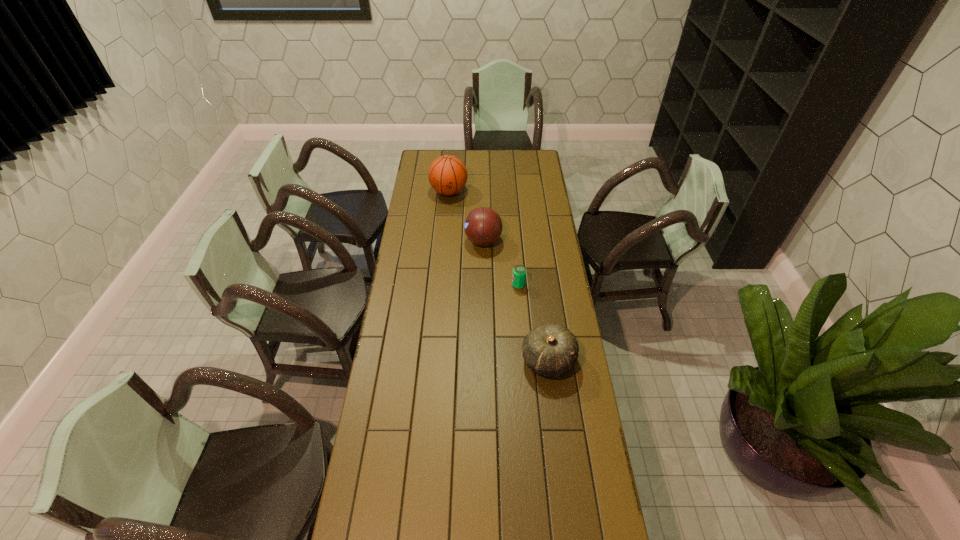
You are a GUI agent. You are given a task and a screenshot of the screen. Output one action in this format:
    pyautogui.click(x=<x>, y=<y>)
    Task: Click on the free space between the gourd and the nearer basketball
    
    Given the screenshot: What is the action you would take?
    pyautogui.click(x=516, y=301)

This screenshot has width=960, height=540. In order to click on free space between the second farthest object and the nearest object in this screenshot , I will do [516, 301].

You are a GUI agent. You are given a task and a screenshot of the screen. Output one action in this format:
    pyautogui.click(x=<x>, y=<y>)
    Task: Click on the free space between the pop soda and the third tallest object
    This screenshot has height=540, width=960.
    Given the screenshot: What is the action you would take?
    pyautogui.click(x=533, y=323)

Where is `empty space between the farther basketball and the shorter basketball`? The height and width of the screenshot is (540, 960). empty space between the farther basketball and the shorter basketball is located at coordinates (466, 217).

Select which object is the closest to the nearer basketball. Please provide its 2D coordinates. Your answer should be formatted as a tuple, i.e. [(x, y)], where the tuple contains the x and y coordinates of a point satisfying the conditions above.

[(519, 272)]

Identify the location of object that can be found as the closest to the shorter basketball. This screenshot has width=960, height=540. 519,272.

Identify the location of vacant point that satisfies the following two spatial constraints: 1. on the front side of the nearer basketball; 2. on the left side of the farthest object. The width and height of the screenshot is (960, 540). (444, 241).